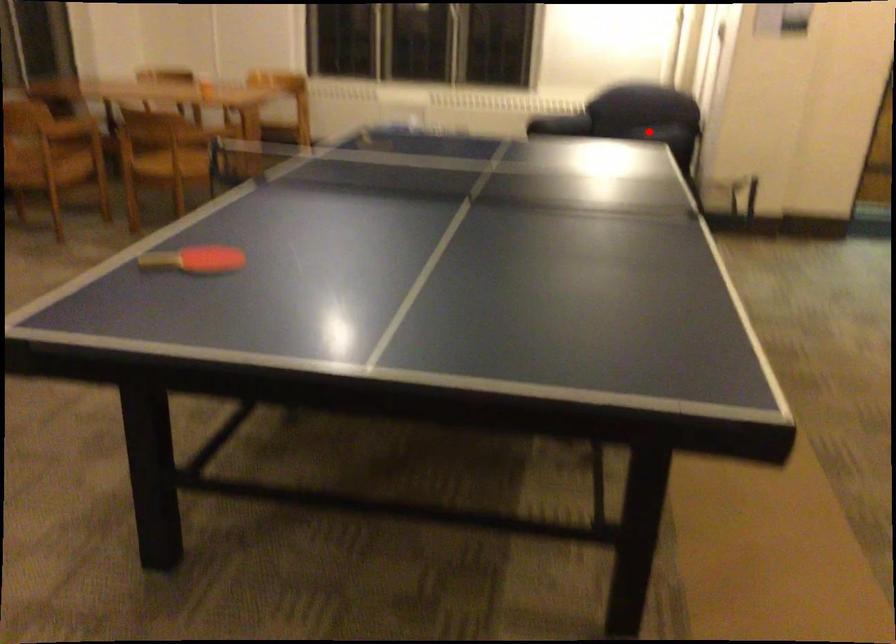
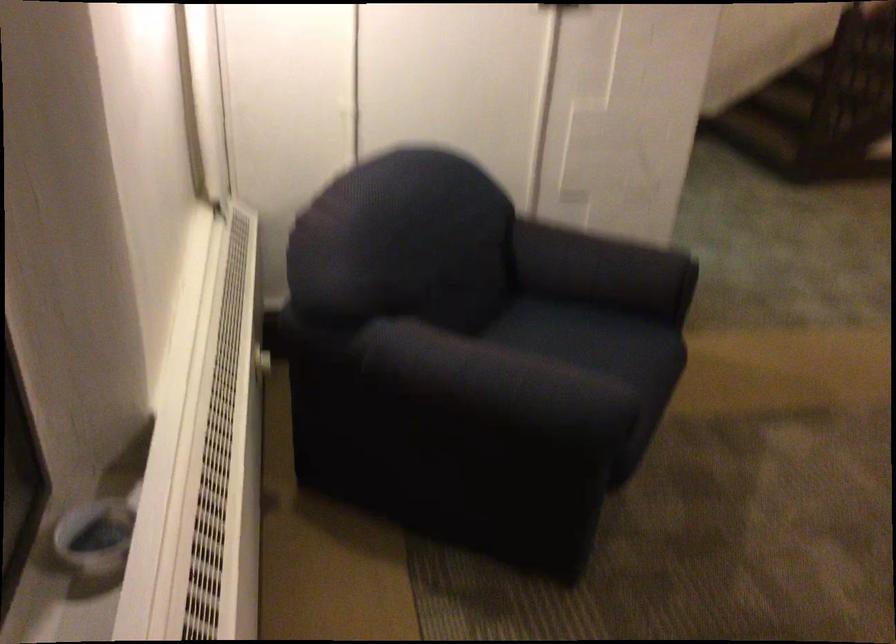
Question: I am providing you with two images of the same scene from different viewpoints. In image1, a red point is highlighted. Considering the same 3D point in image2, which of the following is correct?

Choices:
 (A) It is closer
 (B) It is farther

Answer: (A)